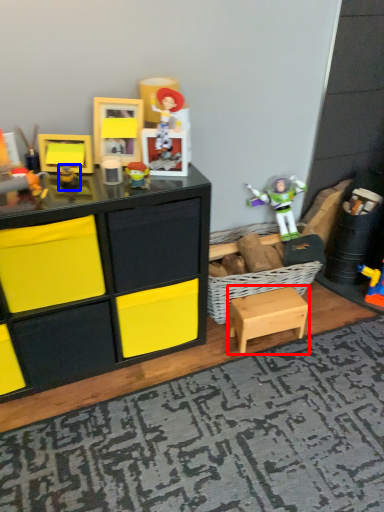
Question: Which of the following is the farthest to the observer, table (highlighted by a red box) or toy (highlighted by a blue box)?

Choices:
 (A) table
 (B) toy

Answer: (A)